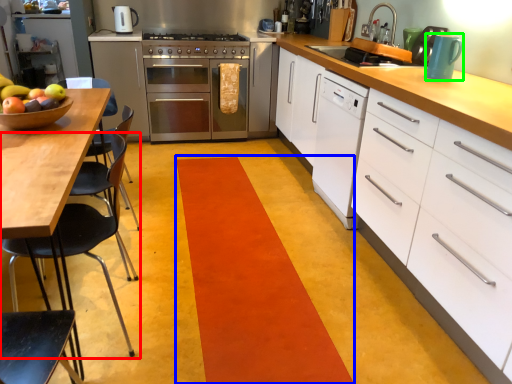
Question: Which object is positioned farthest from chair (highlighted by a red box)? Select from strip (highlighted by a blue box) and kitchen appliance (highlighted by a green box).

Choices:
 (A) strip
 (B) kitchen appliance

Answer: (B)